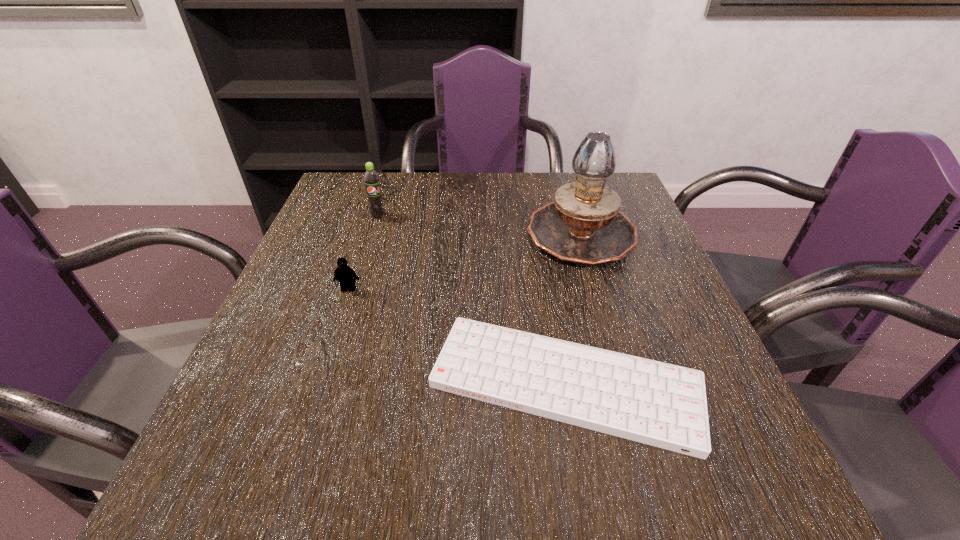
What are the coordinates of `empty location between the computer keyboard and the oil lamp` in the screenshot? It's located at (573, 308).

Image resolution: width=960 pixels, height=540 pixels. I want to click on object that is the second closest to the oil lamp, so click(x=371, y=178).

Locate an element on the screen. Image resolution: width=960 pixels, height=540 pixels. object that stands as the closest to the third shortest object is located at coordinates (344, 274).

At what (x,y) coordinates should I click in order to perform the action: click on vacant area in the image that satisfies the following two spatial constraints: 1. on the front label of the computer keyboard; 2. on the left side of the third shortest object. Please return your answer as a coordinate pair (x, y). Looking at the image, I should click on (325, 383).

Identify the location of vacant point that satisfies the following two spatial constraints: 1. on the front label of the third shortest object; 2. on the right side of the shortest object. The image size is (960, 540). (325, 383).

Where is `free location that satisfies the following two spatial constraints: 1. on the front label of the oil lamp; 2. on the left side of the soda`? Image resolution: width=960 pixels, height=540 pixels. free location that satisfies the following two spatial constraints: 1. on the front label of the oil lamp; 2. on the left side of the soda is located at coordinates (372, 233).

Find the location of a particular element. Image resolution: width=960 pixels, height=540 pixels. free point that satisfies the following two spatial constraints: 1. on the front label of the oil lamp; 2. on the left side of the third shortest object is located at coordinates (372, 233).

Locate an element on the screen. This screenshot has height=540, width=960. free spot that satisfies the following two spatial constraints: 1. on the front label of the soda; 2. on the right side of the oil lamp is located at coordinates (372, 233).